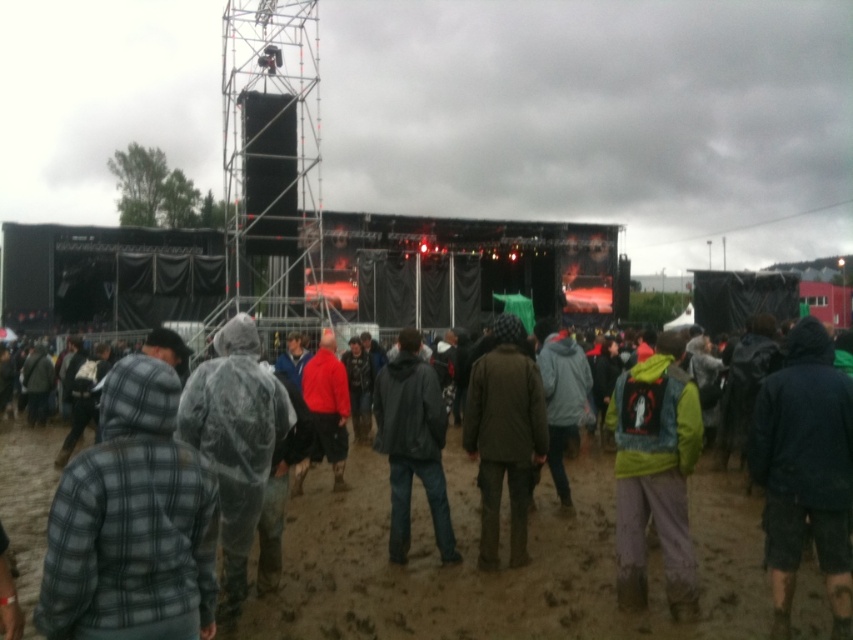
Describe the element at coordinates (654, 474) in the screenshot. The image size is (853, 640). I see `green matte jacket at center` at that location.

Between green matte jacket at center and dark brown leather jacket at center, which one appears on the right side from the viewer's perspective?

From the viewer's perspective, green matte jacket at center appears more on the right side.

Is point (631, 492) behind point (509, 324)?

That is False.

The image size is (853, 640). Identify the location of green matte jacket at center. (654, 474).

Is plaid wool jacket at lower left shorter than dark blue jacket at center?

No.

Is plaid wool jacket at lower left above dark blue jacket at center?

No, plaid wool jacket at lower left is not above dark blue jacket at center.

From the picture: Measure the distance between point (149, 536) and camera.

A distance of 5.93 meters exists between point (149, 536) and camera.

Where is `plaid wool jacket at lower left`? The width and height of the screenshot is (853, 640). plaid wool jacket at lower left is located at coordinates (131, 522).

Is dark blue jacket at center smaller than red matte jacket at center?

Indeed, dark blue jacket at center has a smaller size compared to red matte jacket at center.

Can you confirm if dark blue jacket at center is positioned below red matte jacket at center?

Actually, dark blue jacket at center is above red matte jacket at center.

Does point (834, 412) come in front of point (332, 438)?

Yes, it is.

Image resolution: width=853 pixels, height=640 pixels. Find the location of `dark blue jacket at center`. dark blue jacket at center is located at coordinates (805, 472).